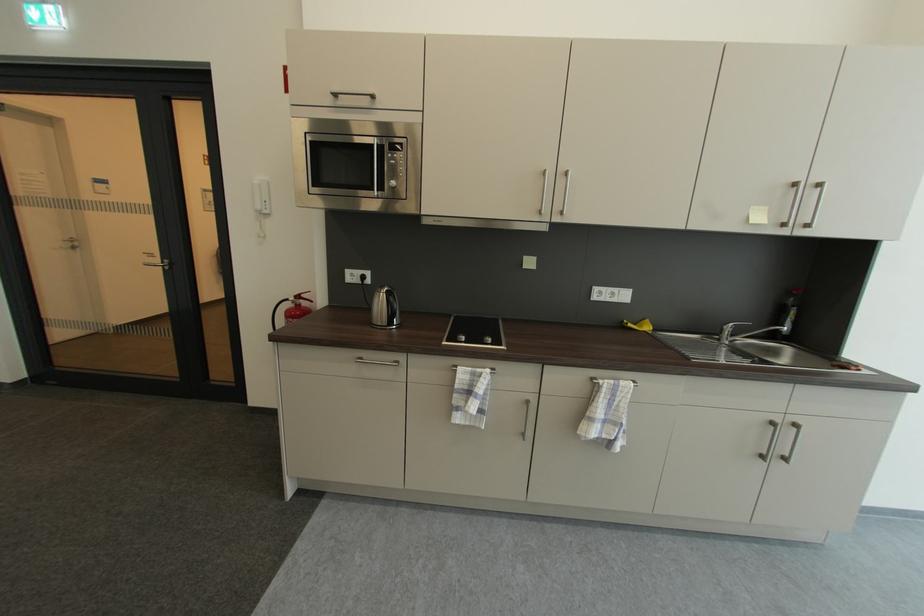
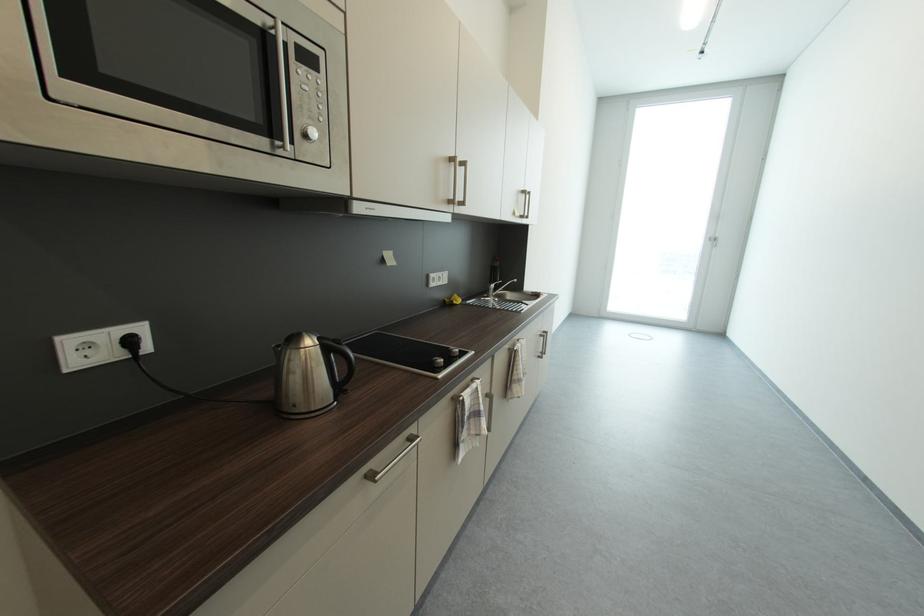
In the second image, find the point that corresponds to pixel 604 385 in the first image.

(523, 351)